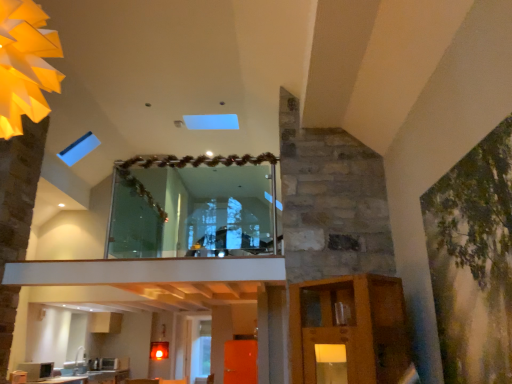
Question: Could you tell me if transparent glass window at center is turned towards transparent glass door at center?

Choices:
 (A) yes
 (B) no

Answer: (A)

Question: Is transparent glass window at center in contact with transparent glass door at center?

Choices:
 (A) no
 (B) yes

Answer: (A)

Question: From the image's perspective, is transparent glass window at center on transparent glass door at center?

Choices:
 (A) yes
 (B) no

Answer: (A)

Question: Is transparent glass window at center smaller than transparent glass door at center?

Choices:
 (A) yes
 (B) no

Answer: (A)

Question: Is transparent glass window at center closer to the viewer compared to transparent glass door at center?

Choices:
 (A) no
 (B) yes

Answer: (B)

Question: Is transparent glass door at center surrounded by transparent glass window at center?

Choices:
 (A) no
 (B) yes

Answer: (A)

Question: From the image's perspective, does matte black microwave at lower left appear higher than transparent glass window at center?

Choices:
 (A) yes
 (B) no

Answer: (B)

Question: Can you confirm if matte black microwave at lower left is positioned to the right of transparent glass window at center?

Choices:
 (A) yes
 (B) no

Answer: (B)

Question: Is matte black microwave at lower left aimed at transparent glass window at center?

Choices:
 (A) no
 (B) yes

Answer: (A)

Question: Are matte black microwave at lower left and transparent glass window at center located far from each other?

Choices:
 (A) no
 (B) yes

Answer: (B)

Question: Is matte black microwave at lower left facing away from transparent glass window at center?

Choices:
 (A) no
 (B) yes

Answer: (A)

Question: Is matte black microwave at lower left bigger than transparent glass window at center?

Choices:
 (A) no
 (B) yes

Answer: (A)

Question: Is green matte painting at right thinner than transparent glass door at center?

Choices:
 (A) yes
 (B) no

Answer: (A)